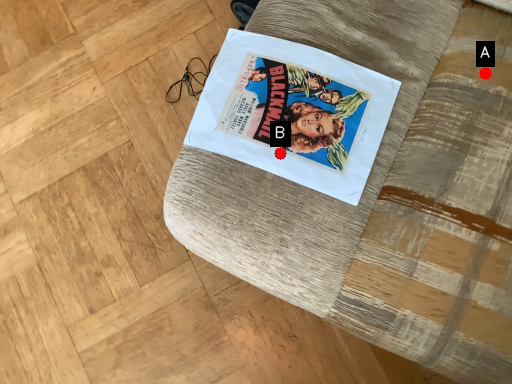
Question: Two points are circled on the image, labeled by A and B beside each circle. Which of the following is the closest to the observer?

Choices:
 (A) A is closer
 (B) B is closer

Answer: (B)